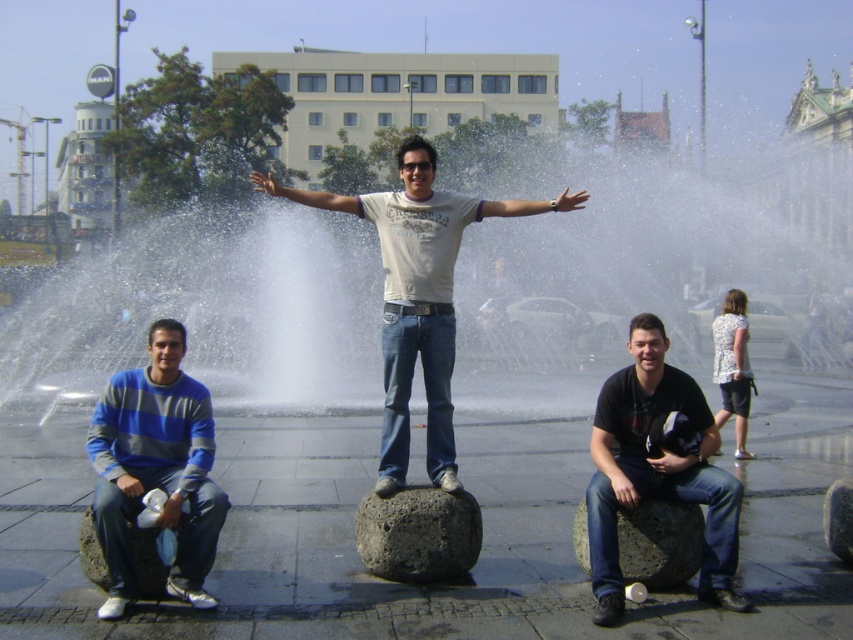
Between clear water at center and smooth gray rock at lower center, which one has less height?

smooth gray rock at lower center

Can you confirm if clear water at center is shorter than smooth gray rock at lower center?

In fact, clear water at center may be taller than smooth gray rock at lower center.

Does point (137, 348) lie in front of point (692, 548)?

No, it is behind (692, 548).

This screenshot has width=853, height=640. I want to click on clear water at center, so click(212, 312).

Is clear water at center above white cotton shirt at center?

Yes, clear water at center is above white cotton shirt at center.

Which is below, clear water at center or white cotton shirt at center?

white cotton shirt at center is below.

Which is in front, point (117, 262) or point (445, 298)?

Positioned in front is point (445, 298).

The image size is (853, 640). I want to click on clear water at center, so click(x=212, y=312).

From the picture: Can you confirm if blue striped sweater at lower left is positioned to the right of black matte shirt at center?

No, blue striped sweater at lower left is not to the right of black matte shirt at center.

Does blue striped sweater at lower left appear over black matte shirt at center?

Yes, blue striped sweater at lower left is above black matte shirt at center.

The width and height of the screenshot is (853, 640). I want to click on blue striped sweater at lower left, so click(x=155, y=468).

Where is `blue striped sweater at lower left`? blue striped sweater at lower left is located at coordinates (155, 468).